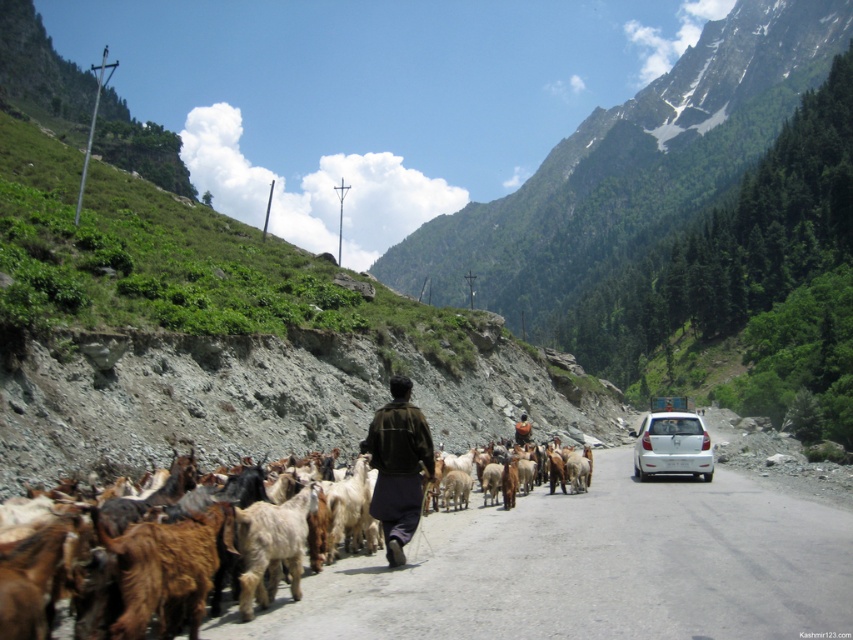
Is brown woolen goats at center closer to camera compared to white matte car at center?

That is True.

Does point (468, 570) come closer to viewer compared to point (704, 451)?

Yes, it is in front of point (704, 451).

The width and height of the screenshot is (853, 640). What are the coordinates of `brown woolen goats at center` in the screenshot? It's located at (593, 566).

Based on the photo, is dark brown fabric at center bigger than brown woolen sweater at center?

Correct, dark brown fabric at center is larger in size than brown woolen sweater at center.

Can you confirm if dark brown fabric at center is positioned above brown woolen sweater at center?

Correct, dark brown fabric at center is located above brown woolen sweater at center.

Identify the location of dark brown fabric at center. click(x=398, y=467).

Where is `dark brown fabric at center`? This screenshot has height=640, width=853. dark brown fabric at center is located at coordinates (398, 467).

Can you confirm if dark brown fabric at center is positioned to the right of white matte car at center?

Incorrect, dark brown fabric at center is not on the right side of white matte car at center.

Does point (358, 442) come farther from viewer compared to point (671, 413)?

Yes, it is.

The width and height of the screenshot is (853, 640). In order to click on dark brown fabric at center in this screenshot , I will do `click(398, 467)`.